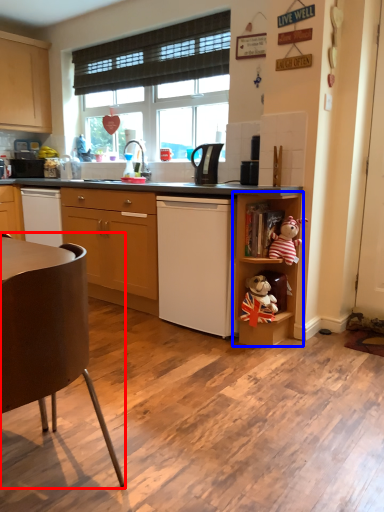
Question: Which point is closer to the camera, chair (highlighted by a red box) or shelf (highlighted by a blue box)?

Choices:
 (A) chair
 (B) shelf

Answer: (A)